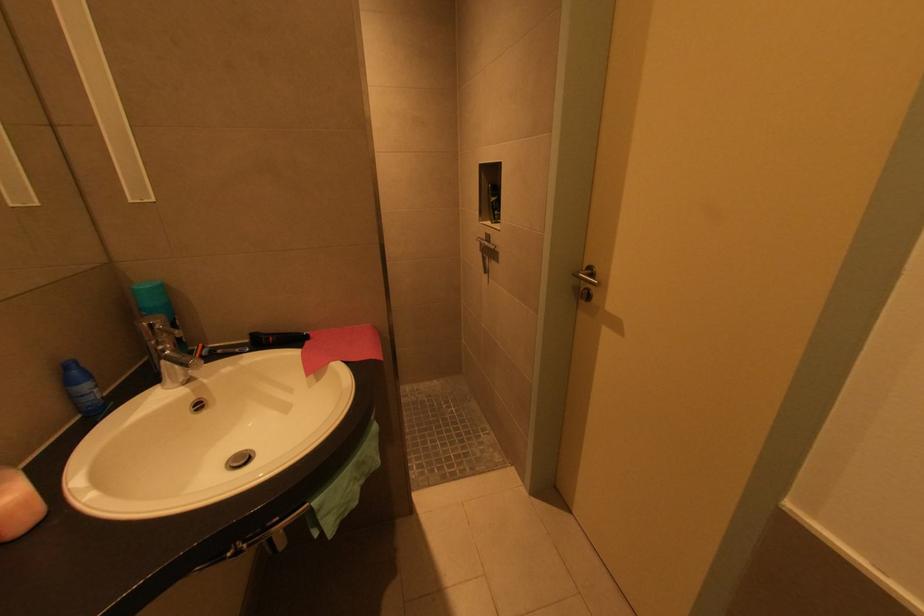
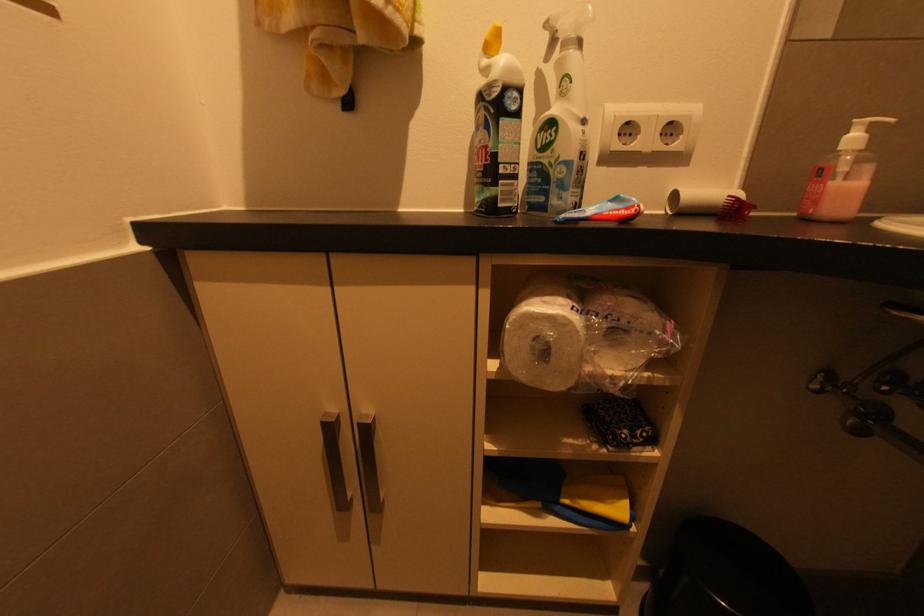
First-person continuous shooting, in which direction is the camera rotating?

The rotation direction of the camera is left-down.